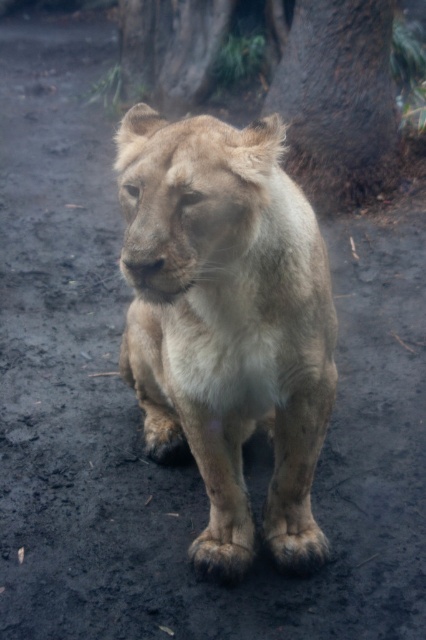
Consider the image. Is fuzzy beige lion at center positioned at the back of brown rough bark at upper center?

No.

Can you confirm if fuzzy beige lion at center is positioned to the right of brown rough bark at upper center?

In fact, fuzzy beige lion at center is to the left of brown rough bark at upper center.

In order to click on fuzzy beige lion at center in this screenshot , I will do `click(227, 321)`.

At what (x,y) coordinates should I click in order to perform the action: click on fuzzy beige lion at center. Please return your answer as a coordinate pair (x, y). The image size is (426, 640). Looking at the image, I should click on (227, 321).